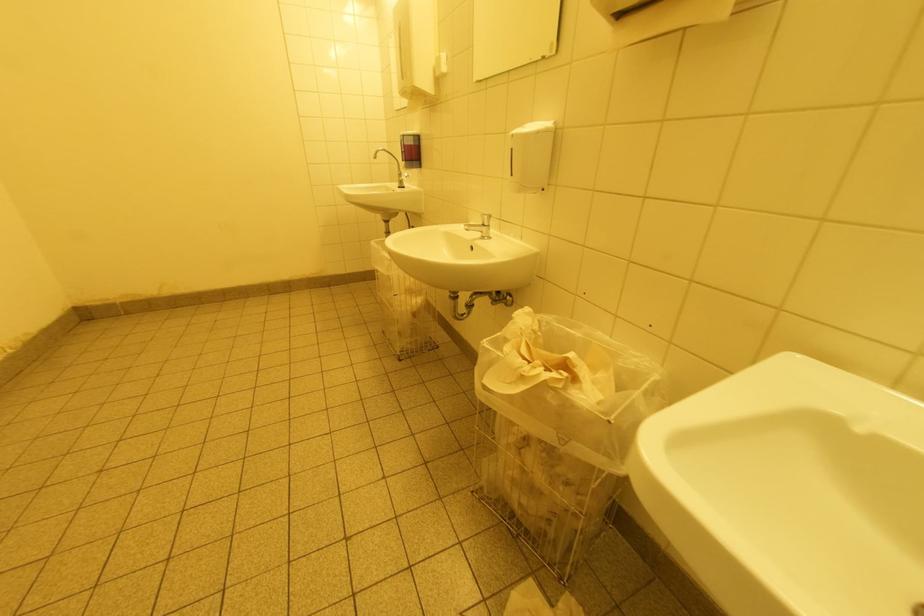
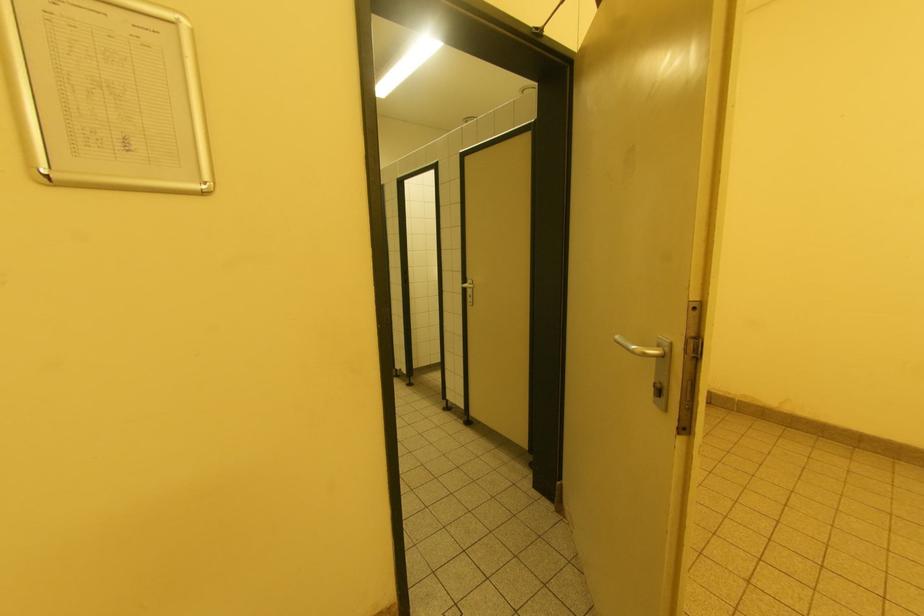
Question: The images are taken continuously from a first-person perspective. In which direction is your viewpoint rotating?

Choices:
 (A) Left
 (B) Right
 (C) Up
 (D) Down

Answer: (A)